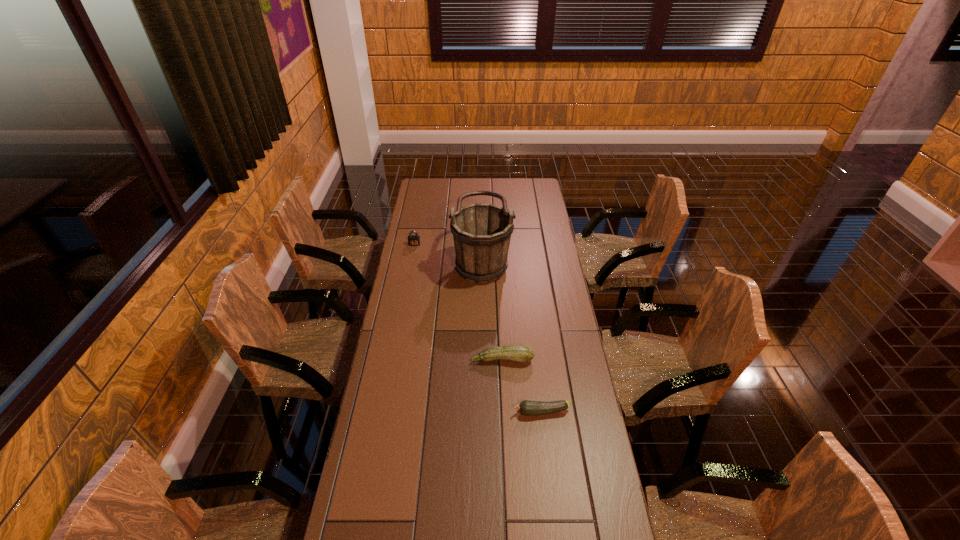
Where is `bucket`? bucket is located at coordinates (481, 232).

Image resolution: width=960 pixels, height=540 pixels. What are the coordinates of `the leftmost object` in the screenshot? It's located at (413, 240).

This screenshot has height=540, width=960. I want to click on the third shortest object, so click(x=413, y=240).

Where is `the taller zucchini`? the taller zucchini is located at coordinates (518, 353).

Find the location of a particular element. the third farthest object is located at coordinates (518, 353).

At what (x,y) coordinates should I click in order to perform the action: click on the nearer zucchini. Please return your answer as a coordinate pair (x, y). This screenshot has width=960, height=540. Looking at the image, I should click on (529, 408).

Where is `the nearest object`? This screenshot has height=540, width=960. the nearest object is located at coordinates (529, 408).

You are a GUI agent. You are given a task and a screenshot of the screen. Output one action in this format:
    pyautogui.click(x=<x>, y=<y>)
    Task: Click on the vacant space located on the handle side of the tallest object
    Image resolution: width=960 pixels, height=540 pixels.
    Given the screenshot: What is the action you would take?
    pyautogui.click(x=409, y=259)

I want to click on vacant space positioned on the handle side of the tallest object, so click(420, 259).

You are a GUI agent. You are given a task and a screenshot of the screen. Output one action in this format:
    pyautogui.click(x=<x>, y=<y>)
    Task: Click on the vacant space located 0.130m on the handle side of the tallest object
    
    Given the screenshot: What is the action you would take?
    pyautogui.click(x=424, y=259)